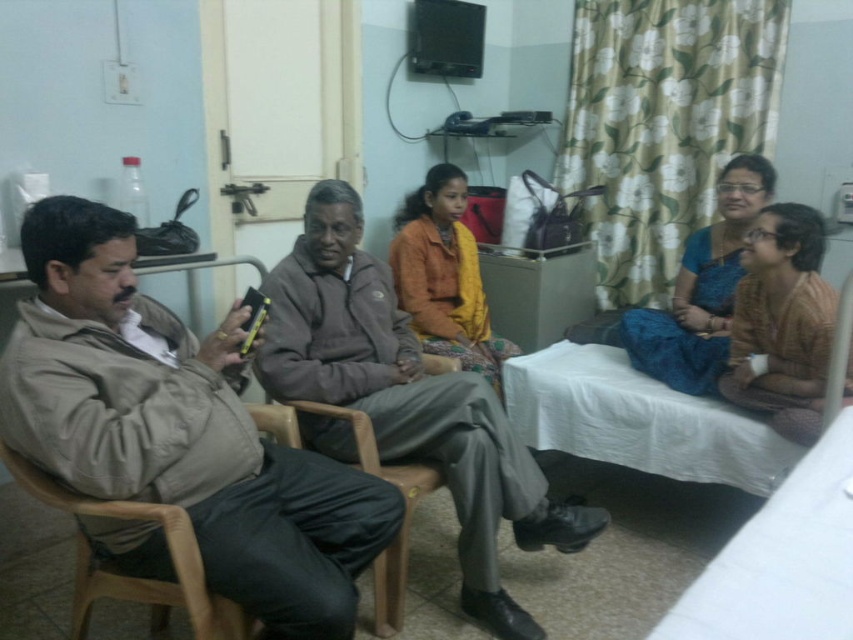
Does beige fabric jacket at left appear under blue silk saree at center?

Indeed, beige fabric jacket at left is positioned under blue silk saree at center.

Is point (210, 577) positioned after point (682, 268)?

No, (210, 577) is closer to viewer.

Does point (119, 211) lie in front of point (648, 332)?

That is True.

Locate an element on the screen. This screenshot has width=853, height=640. beige fabric jacket at left is located at coordinates (178, 428).

Between gray fleece jacket at center and brown textured dress at center, which one appears on the right side from the viewer's perspective?

From the viewer's perspective, brown textured dress at center appears more on the right side.

Measure the distance from gray fleece jacket at center to brown textured dress at center.

gray fleece jacket at center is 33.45 inches from brown textured dress at center.

In order to click on gray fleece jacket at center in this screenshot , I will do `click(408, 400)`.

I want to click on gray fleece jacket at center, so click(x=408, y=400).

In the scene shown: Is beige fabric jacket at left below brown wood chair at left?

Actually, beige fabric jacket at left is above brown wood chair at left.

I want to click on beige fabric jacket at left, so click(x=178, y=428).

At what (x,y) coordinates should I click in order to perform the action: click on beige fabric jacket at left. Please return your answer as a coordinate pair (x, y). The height and width of the screenshot is (640, 853). Looking at the image, I should click on (178, 428).

Identify the location of beige fabric jacket at left. (178, 428).